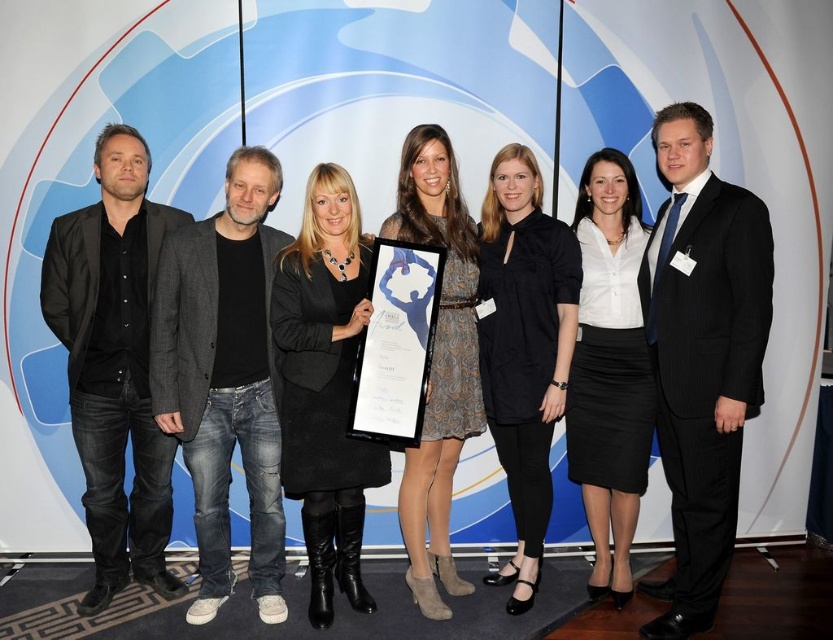
Question: Observing the image, what is the correct spatial positioning of black pinstripe suit at center in reference to black denim jeans at left?

Choices:
 (A) above
 (B) below

Answer: (A)

Question: Does black pinstripe suit at center appear on the right side of black denim jeans at left?

Choices:
 (A) yes
 (B) no

Answer: (A)

Question: Can you confirm if black pinstripe suit at center is wider than black denim jeans at left?

Choices:
 (A) no
 (B) yes

Answer: (A)

Question: Which point is closer to the camera?

Choices:
 (A) black pinstripe suit at center
 (B) black denim jeans at left

Answer: (A)

Question: Which object appears closest to the camera in this image?

Choices:
 (A) black pinstripe suit at center
 (B) black denim jeans at left

Answer: (A)